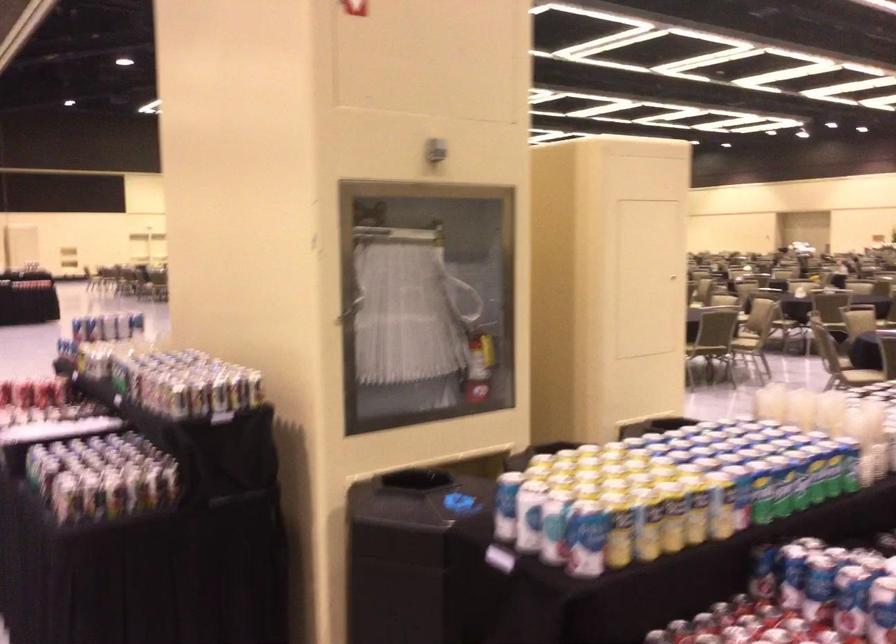
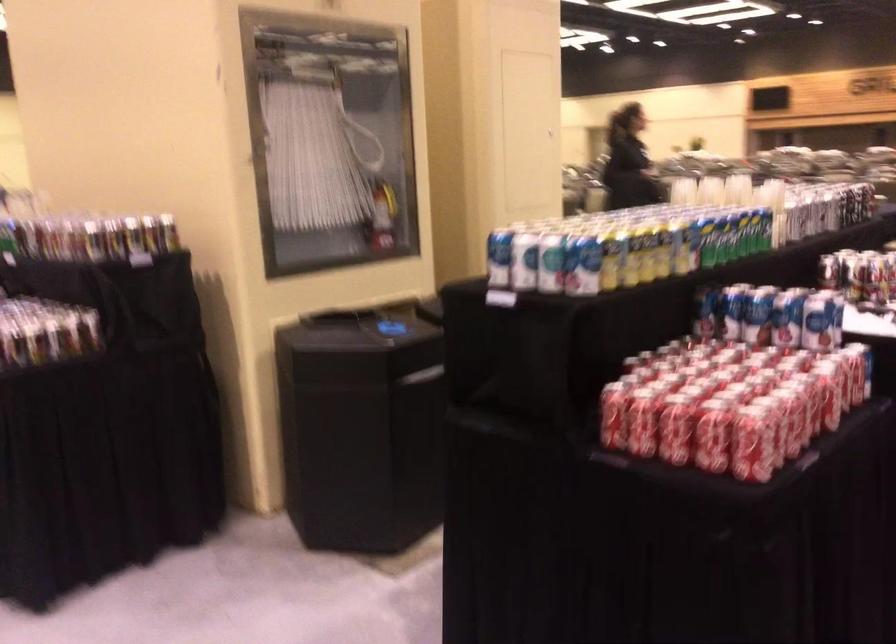
The point at (480, 238) is marked in the first image. Where is the corresponding point in the second image?

(372, 86)